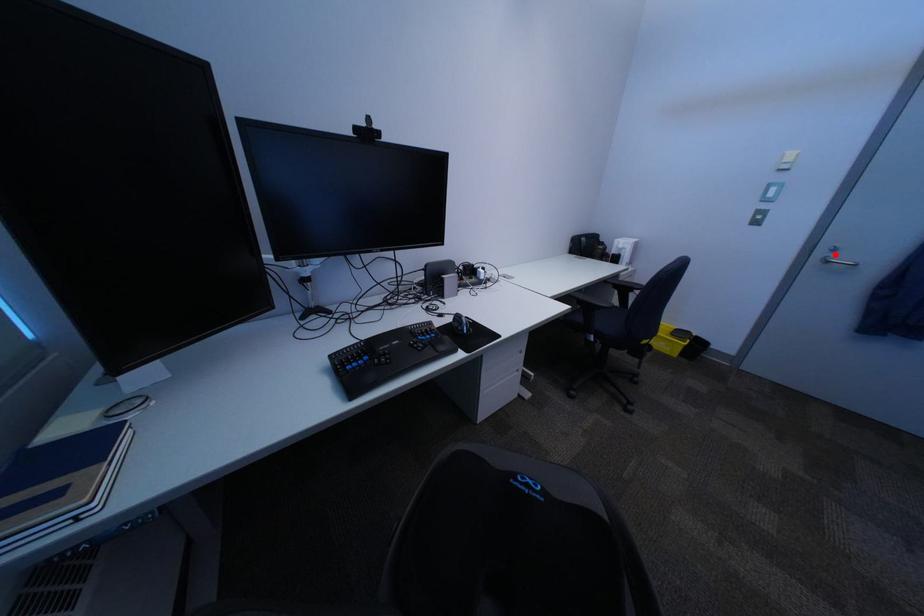
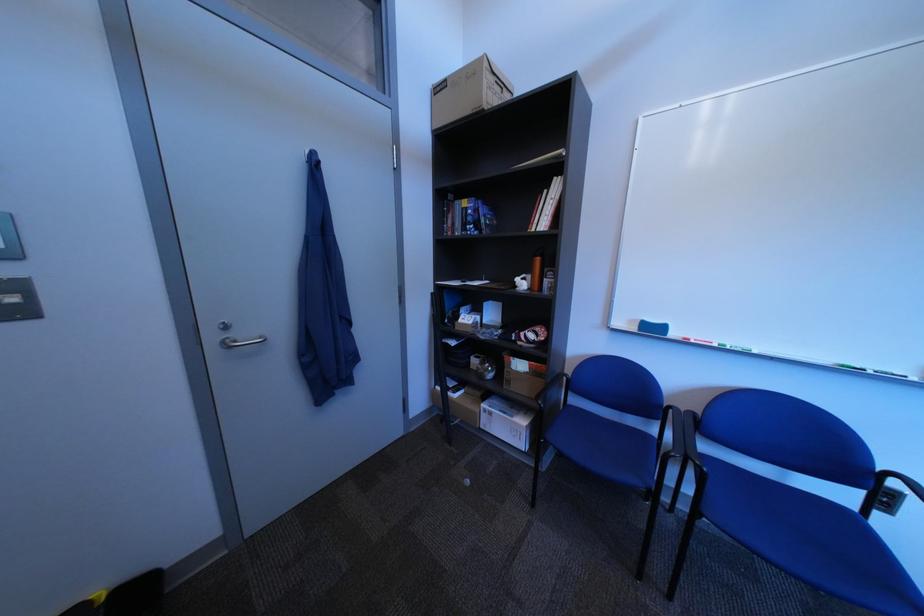
Find the pixel in the second image that matches the highlighted location in the first image.

(226, 339)